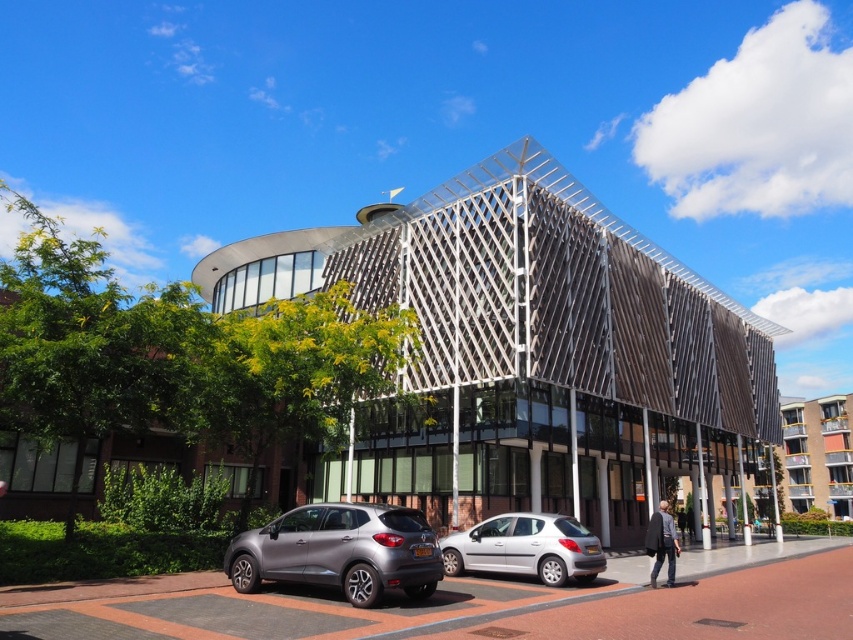
Question: Estimate the real-world distances between objects in this image. Which object is farther from the dark gray sweater at lower right?

Choices:
 (A) wooden lattice structure at center
 (B) silver metallic hatchback at center
 (C) metallic gray suv at lower left
 (D) gray concrete building at center

Answer: (D)

Question: Is silver metallic hatchback at center to the right of gray concrete building at center from the viewer's perspective?

Choices:
 (A) no
 (B) yes

Answer: (A)

Question: Can you confirm if silver metallic hatchback at center is positioned to the left of gray concrete building at center?

Choices:
 (A) no
 (B) yes

Answer: (B)

Question: Is wooden lattice structure at center to the right of gray concrete building at center from the viewer's perspective?

Choices:
 (A) no
 (B) yes

Answer: (A)

Question: Based on their relative distances, which object is farther from the metallic gray suv at lower left?

Choices:
 (A) gray concrete building at center
 (B) wooden lattice structure at center
 (C) dark gray sweater at lower right
 (D) silver metallic hatchback at center

Answer: (A)

Question: Which object is closer to the camera taking this photo?

Choices:
 (A) metallic gray suv at lower left
 (B) silver metallic hatchback at center
 (C) wooden lattice structure at center
 (D) dark gray sweater at lower right

Answer: (A)